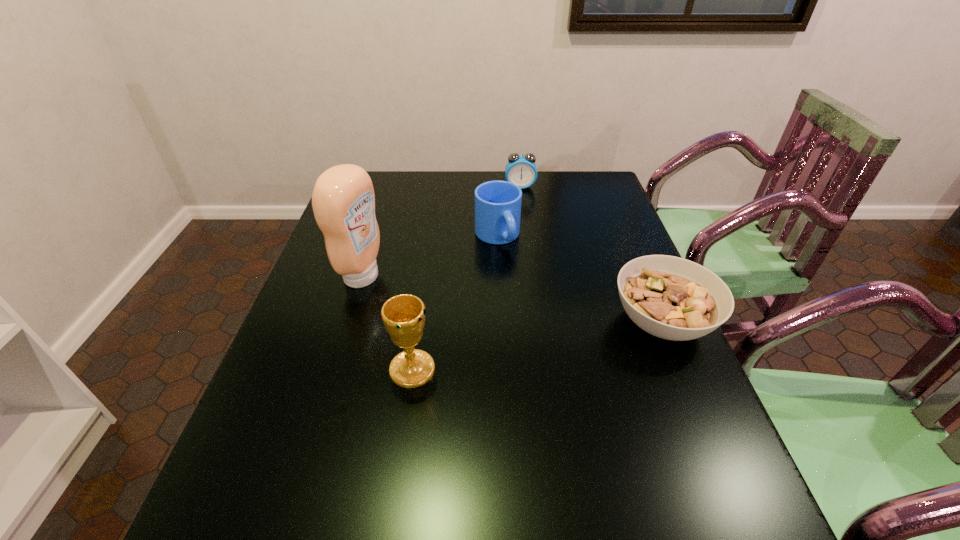
Locate an element on the screen. Image resolution: width=960 pixels, height=540 pixels. vacant space on the desktop that is between the second tallest object and the rightmost object and is positioned on the label of the tallest object is located at coordinates (568, 340).

The width and height of the screenshot is (960, 540). In order to click on free spot on the desktop that is between the fourth object from right to left and the stew and is positioned on the face of the alarm clock in this screenshot , I will do click(535, 346).

In order to click on free space on the desktop that is between the chalice and the stew and is positioned on the side of the fourth nearest object with the handle in this screenshot , I will do `click(569, 340)`.